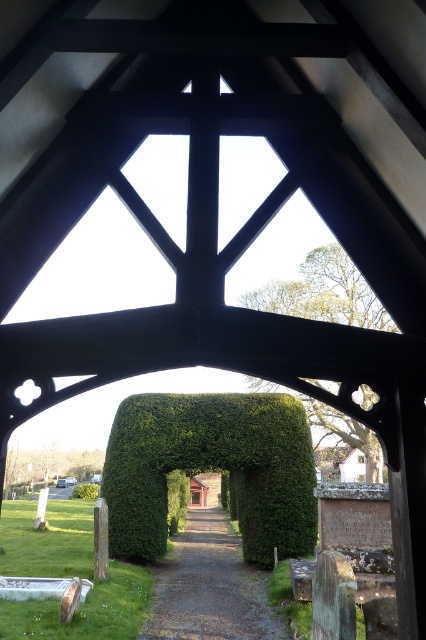
Who is more forward, (192,460) or (195,596)?

Point (195,596) is in front.

Is point (304, 451) more distant than point (255, 627)?

That is True.

Between point (273, 420) and point (170, 625), which one is positioned behind?

The point (273, 420) is behind.

At what (x,y) coordinates should I click in order to perform the action: click on green leafy hedge at center. Please return your answer as a coordinate pair (x, y). Looking at the image, I should click on (212, 468).